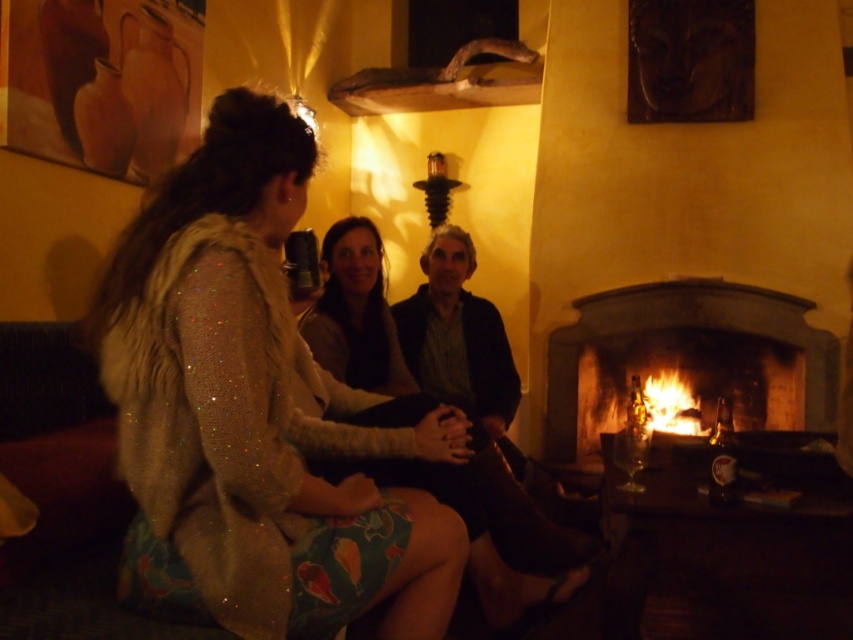
You are standing in the living room and want to place a 12 feet long ladder against the wall behind the wooden fireplace at right. Can you fit the ladder there without moving the fireplace?

The wooden fireplace at right is 11.78 feet away from the camera. Since the ladder is 12 feet long, it would be slightly too long to fit without moving the fireplace.

Consider the image. You are standing in the living room and want to place a decorative item between the wooden fireplace at right and the flaming wood at right. Is there enough space to place it there?

The wooden fireplace at right is to the right of the flaming wood at right, so there is space between them to place a decorative item.

You are standing in the living room and want to place a small decorative item on the table in front of the fireplace. You have two options for placement locations marked as point A and point B. Point A is at coordinate point(160, 358) and point B is at coordinate point(393, 381). Which point is closer to you?

Point A at coordinate point(160, 358) is closer to the viewer than point B at coordinate point(393, 381).